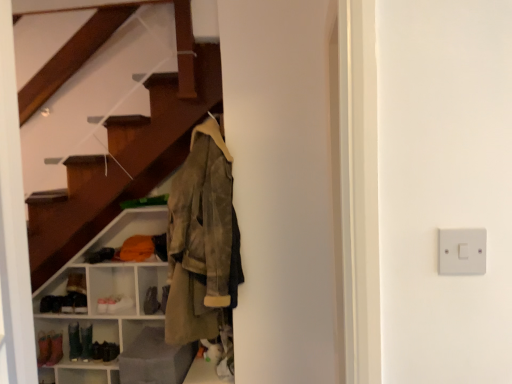
What is the approximate width of olive suede jacket at center?

The width of olive suede jacket at center is 12.33 inches.

What is the approximate height of olive suede jacket at center?

It is 3.47 feet.

Describe the element at coordinates (151, 301) in the screenshot. Image resolution: width=512 pixels, height=384 pixels. I see `leather shoe at lower left` at that location.

In order to face white plastic switch at right, should I rotate leftwards or rightwards?

To face it directly, rotate right by 25.912 degrees.

What is the approximate height of white plastic switch at right?

It is 3.56 inches.

Locate an element on the screen. The height and width of the screenshot is (384, 512). matte white shelving unit at lower left is located at coordinates (104, 297).

Locate an element on the screen. matte gray ottoman at lower left is located at coordinates (155, 359).

At what (x,y) coordinates should I click in order to perform the action: click on olive suede jacket at center. Please return your answer as a coordinate pair (x, y). Looking at the image, I should click on (201, 239).

Could you tell me if olive suede jacket at center is turned towards matte white shelving unit at lower left?

No, olive suede jacket at center is not aimed at matte white shelving unit at lower left.

Does olive suede jacket at center touch matte white shelving unit at lower left?

No, olive suede jacket at center is not making contact with matte white shelving unit at lower left.

From a real-world perspective, is olive suede jacket at center beneath matte white shelving unit at lower left?

No, from a real-world perspective, olive suede jacket at center is not under matte white shelving unit at lower left.

Is olive suede jacket at center positioned in front of matte white shelving unit at lower left?

Yes, the depth of olive suede jacket at center is less than that of matte white shelving unit at lower left.

Is matte white shelving unit at lower left positioned behind olive suede jacket at center?

Yes, the depth of matte white shelving unit at lower left is greater than that of olive suede jacket at center.

Is olive suede jacket at center a part of matte white shelving unit at lower left?

No, olive suede jacket at center is not inside matte white shelving unit at lower left.

Considering the sizes of objects matte white shelving unit at lower left and olive suede jacket at center in the image provided, who is smaller, matte white shelving unit at lower left or olive suede jacket at center?

With smaller size is olive suede jacket at center.

From the image's perspective, which is above, matte white shelving unit at lower left or olive suede jacket at center?

olive suede jacket at center, from the image's perspective.

From a real-world perspective, is matte gray ottoman at lower left over white plastic switch at right?

Actually, matte gray ottoman at lower left is physically below white plastic switch at right in the real world.

How different are the orientations of matte gray ottoman at lower left and white plastic switch at right in degrees?

The angle between the facing direction of matte gray ottoman at lower left and the facing direction of white plastic switch at right is 89.4 degrees.

Which is more to the left, matte gray ottoman at lower left or white plastic switch at right?

matte gray ottoman at lower left is more to the left.

Considering the relative sizes of matte gray ottoman at lower left and white plastic switch at right in the image provided, is matte gray ottoman at lower left smaller than white plastic switch at right?

Actually, matte gray ottoman at lower left might be larger than white plastic switch at right.

From a real-world perspective, does olive suede jacket at center sit lower than leather shoe at lower left?

No, from a real-world perspective, olive suede jacket at center is not below leather shoe at lower left.

Can you confirm if olive suede jacket at center is bigger than leather shoe at lower left?

Indeed, olive suede jacket at center has a larger size compared to leather shoe at lower left.

Where is `shoe located underneath the olive suede jacket at center (from a real-world perspective)`? This screenshot has height=384, width=512. shoe located underneath the olive suede jacket at center (from a real-world perspective) is located at coordinates (151, 301).

Is leather shoe at lower left looking in the opposite direction of matte gray ottoman at lower left?

leather shoe at lower left does not have its back to matte gray ottoman at lower left.

Based on the photo, from a real-world perspective, who is located higher, leather shoe at lower left or matte gray ottoman at lower left?

In real-world perspective, leather shoe at lower left is above.

Where is `gray on the right of leather shoe at lower left`? The image size is (512, 384). gray on the right of leather shoe at lower left is located at coordinates (155, 359).

Is leather shoe at lower left in front of matte gray ottoman at lower left?

No, leather shoe at lower left is behind matte gray ottoman at lower left.

Is point (455, 249) closer to viewer compared to point (157, 309)?

Yes.

From the image's perspective, does white plastic switch at right appear lower than leather shoe at lower left?

No.

Looking at this image, considering the relative sizes of white plastic switch at right and leather shoe at lower left in the image provided, is white plastic switch at right wider than leather shoe at lower left?

No, white plastic switch at right is not wider than leather shoe at lower left.

Which is in front, matte white shelving unit at lower left or matte gray ottoman at lower left?

matte gray ottoman at lower left.

From a real-world perspective, is matte white shelving unit at lower left on matte gray ottoman at lower left?

Correct, in the physical world, matte white shelving unit at lower left is higher than matte gray ottoman at lower left.

Is matte white shelving unit at lower left to the right of matte gray ottoman at lower left from the viewer's perspective?

In fact, matte white shelving unit at lower left is to the left of matte gray ottoman at lower left.

Locate an element on the screen. Image resolution: width=512 pixels, height=384 pixels. gray that appears on the right of matte white shelving unit at lower left is located at coordinates (155, 359).

At what (x,y) coordinates should I click in order to perform the action: click on shelf below the olive suede jacket at center (from a real-world perspective). Please return your answer as a coordinate pair (x, y). Looking at the image, I should click on (104, 297).

At what (x,y) coordinates should I click in order to perform the action: click on jacket on the right side of matte white shelving unit at lower left. Please return your answer as a coordinate pair (x, y). Looking at the image, I should click on (201, 239).

From the image, which object appears to be nearer to olive suede jacket at center, matte white shelving unit at lower left or leather shoe at lower left?

matte white shelving unit at lower left.

Based on their spatial positions, is white plastic switch at right or olive suede jacket at center further from matte gray ottoman at lower left?

white plastic switch at right is further to matte gray ottoman at lower left.

Looking at the image, which one is located further to matte white shelving unit at lower left, white plastic switch at right or leather shoe at lower left?

The object further to matte white shelving unit at lower left is white plastic switch at right.

Consider the image. Based on their spatial positions, is matte gray ottoman at lower left or leather shoe at lower left closer to white plastic switch at right?

matte gray ottoman at lower left lies closer to white plastic switch at right than the other object.

Considering their positions, is matte gray ottoman at lower left positioned closer to matte white shelving unit at lower left than olive suede jacket at center?

matte gray ottoman at lower left lies closer to matte white shelving unit at lower left than the other object.

From the image, which object appears to be nearer to matte gray ottoman at lower left, leather shoe at lower left or matte white shelving unit at lower left?

Based on the image, leather shoe at lower left appears to be nearer to matte gray ottoman at lower left.

Based on their spatial positions, is matte gray ottoman at lower left or white plastic switch at right closer to matte white shelving unit at lower left?

matte gray ottoman at lower left is closer to matte white shelving unit at lower left.

Which object lies nearer to the anchor point matte white shelving unit at lower left, olive suede jacket at center or white plastic switch at right?

olive suede jacket at center.

Identify the location of gray positioned between olive suede jacket at center and matte white shelving unit at lower left from near to far. Image resolution: width=512 pixels, height=384 pixels. (155, 359).

Find the location of a particular element. Image resolution: width=512 pixels, height=384 pixels. shelf positioned between olive suede jacket at center and leather shoe at lower left from near to far is located at coordinates (104, 297).

Identify the location of jacket between white plastic switch at right and matte white shelving unit at lower left in the front-back direction. (201, 239).

The width and height of the screenshot is (512, 384). I want to click on gray positioned between white plastic switch at right and matte white shelving unit at lower left from near to far, so click(x=155, y=359).